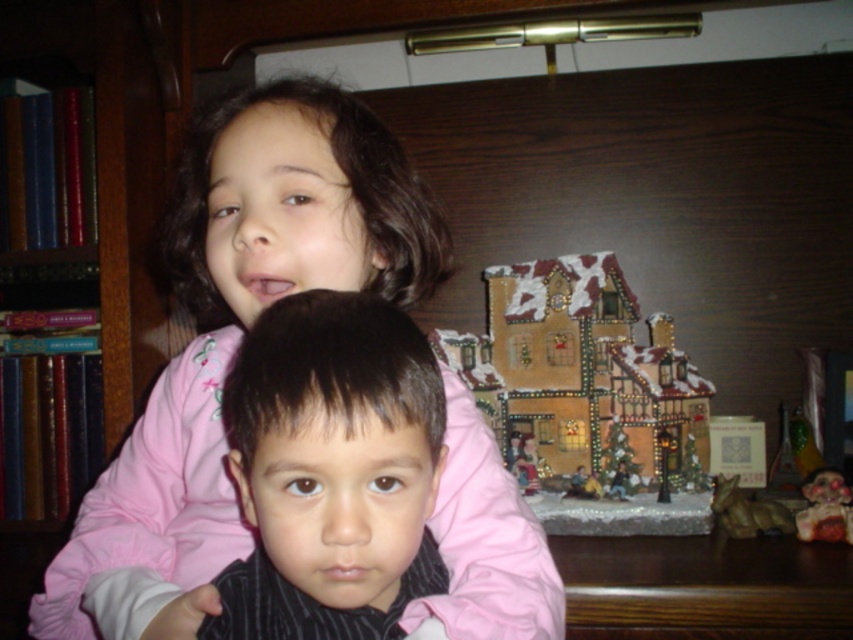
You are taking a photo of the children and notice the matte pink shirt at upper center and the camera. Which object is closer to the camera?

The matte pink shirt at upper center is closer to the camera since it is the one being observed, while the camera itself is the tool used to take the photo. However, based on the description, the distance between them is 18.31 inches, meaning the matte pink shirt at upper center is in front of the camera at that distance.

Looking at this image, you are a photographer trying to capture a clear shot of the black striped shirt at center without the matte pink shirt at upper center blocking it. Can you adjust your angle to achieve this?

The matte pink shirt at upper center is positioned over the black striped shirt at center, so adjusting your angle downward might allow you to capture the black striped shirt at center without obstruction.

You are a photographer trying to capture a clear shot of the wooden bookshelf at left. However, the matte pink shirt at upper center is blocking your view. Can you estimate how much you need to move the camera to the side to avoid the obstruction?

The matte pink shirt at upper center is in front of the wooden bookshelf at left, so moving the camera to the side would allow you to see the wooden bookshelf at left without obstruction.